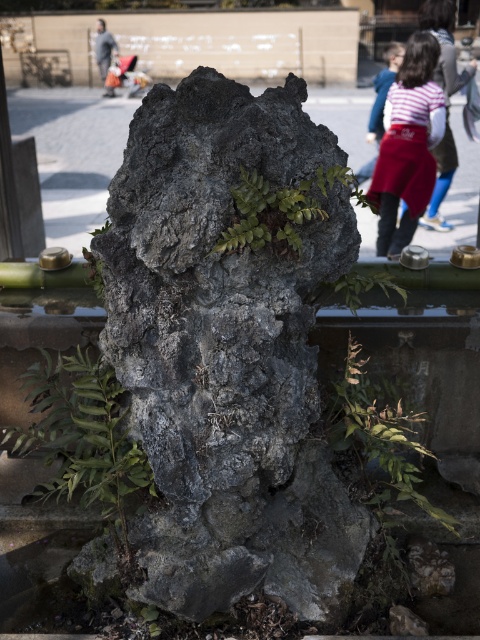
Does rough stone rock at center have a greater width compared to green leafy plant at lower left?

Correct, the width of rough stone rock at center exceeds that of green leafy plant at lower left.

Does rough stone rock at center appear on the left side of green leafy plant at lower left?

No, rough stone rock at center is not to the left of green leafy plant at lower left.

Does point (177, 180) come in front of point (106, 374)?

That is True.

Identify the location of rough stone rock at center. This screenshot has width=480, height=640. (227, 355).

Is point (13, 426) positioned in front of point (105, 76)?

Yes, point (13, 426) is closer to viewer.

Between point (154, 490) and point (104, 38), which one is positioned behind?

The point (104, 38) is behind.

Identify the location of green leafy plant at lower left. This screenshot has height=640, width=480. (83, 436).

Looking at this image, is rough stone rock at center shorter than striped fabric shirt at upper right?

Indeed, rough stone rock at center has a lesser height compared to striped fabric shirt at upper right.

The height and width of the screenshot is (640, 480). Identify the location of rough stone rock at center. (227, 355).

Is point (327, 572) behind point (416, 200)?

No, it is not.

Identify the location of rough stone rock at center. The height and width of the screenshot is (640, 480). point(227,355).